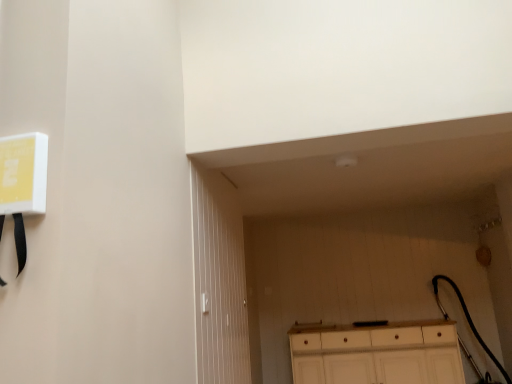
The width and height of the screenshot is (512, 384). What do you see at coordinates (377, 354) in the screenshot?
I see `white wood cabinet at lower center` at bounding box center [377, 354].

Measure the distance between white wood cabinet at lower center and camera.

white wood cabinet at lower center is 3.79 meters from camera.

Find the location of a particular element. The width and height of the screenshot is (512, 384). white wood cabinet at lower center is located at coordinates (377, 354).

What are the coordinates of `white wooden door at center` in the screenshot? It's located at (219, 280).

Describe the element at coordinates (219, 280) in the screenshot. I see `white wooden door at center` at that location.

Measure the distance between white wooden door at center and camera.

The distance of white wooden door at center from camera is 1.95 meters.

What is the approximate height of white wooden door at center?

white wooden door at center is 1.38 meters tall.

Locate an element on the screen. white wood cabinet at lower center is located at coordinates (377, 354).

Can you confirm if white wood cabinet at lower center is positioned to the left of white wooden door at center?

Incorrect, white wood cabinet at lower center is not on the left side of white wooden door at center.

Considering the relative positions of white wood cabinet at lower center and white wooden door at center in the image provided, is white wood cabinet at lower center behind white wooden door at center?

Yes, it is.

Which is farther from the camera, (462, 380) or (196, 293)?

The point (462, 380) is more distant.

From the image's perspective, relative to white wooden door at center, is white wood cabinet at lower center above or below?

white wood cabinet at lower center is below white wooden door at center.

From a real-world perspective, is white wood cabinet at lower center positioned above or below white wooden door at center?

From a real-world perspective, white wood cabinet at lower center is physically below white wooden door at center.

In terms of width, does white wood cabinet at lower center look wider or thinner when compared to white wooden door at center?

Considering their sizes, white wood cabinet at lower center looks broader than white wooden door at center.

Between white wood cabinet at lower center and white wooden door at center, which one has more height?

With more height is white wooden door at center.

Is white wood cabinet at lower center bigger than white wooden door at center?

Yes.

Would you say white wood cabinet at lower center is outside white wooden door at center?

white wood cabinet at lower center lies outside white wooden door at center's area.

Is white wood cabinet at lower center far from white wooden door at center?

Yes, white wood cabinet at lower center and white wooden door at center are located far from each other.

Is white wood cabinet at lower center oriented away from white wooden door at center?

No, white wood cabinet at lower center is not facing away from white wooden door at center.

From the picture: Can you tell me how much white wood cabinet at lower center and white wooden door at center differ in facing direction?

The angular difference between white wood cabinet at lower center and white wooden door at center is 91.7 degrees.

Measure the distance from white wood cabinet at lower center to white wooden door at center.

They are 1.62 meters apart.

The image size is (512, 384). Identify the location of door above the white wood cabinet at lower center (from a real-world perspective). (219, 280).

Considering the relative positions of white wooden door at center and white wood cabinet at lower center in the image provided, is white wooden door at center to the right of white wood cabinet at lower center from the viewer's perspective?

No.

Is white wooden door at center behind white wood cabinet at lower center?

No.

Is point (214, 232) farther from camera compared to point (348, 375)?

No, it is not.

From the image's perspective, which object appears higher, white wooden door at center or white wood cabinet at lower center?

white wooden door at center appears higher in the image.

From a real-world perspective, is white wooden door at center located beneath white wood cabinet at lower center?

Incorrect, from a real-world perspective, white wooden door at center is higher than white wood cabinet at lower center.

Considering the sizes of objects white wooden door at center and white wood cabinet at lower center in the image provided, who is wider, white wooden door at center or white wood cabinet at lower center?

white wood cabinet at lower center.

Between white wooden door at center and white wood cabinet at lower center, which one has more height?

white wooden door at center is taller.

Can you confirm if white wooden door at center is bigger than white wood cabinet at lower center?

Incorrect, white wooden door at center is not larger than white wood cabinet at lower center.

Would you say white wood cabinet at lower center is part of white wooden door at center's contents?

No, white wood cabinet at lower center is not a part of white wooden door at center.

Are white wooden door at center and white wood cabinet at lower center located far from each other?

Yes.

Is white wooden door at center turned away from white wood cabinet at lower center?

No, white wooden door at center is not facing away from white wood cabinet at lower center.

How different are the orientations of white wooden door at center and white wood cabinet at lower center in degrees?

The facing directions of white wooden door at center and white wood cabinet at lower center are 91.7 degrees apart.

Where is `cabinetry that appears below the white wooden door at center (from the image's perspective)`? This screenshot has width=512, height=384. cabinetry that appears below the white wooden door at center (from the image's perspective) is located at coordinates [x=377, y=354].

In order to click on cabinetry behind the white wooden door at center in this screenshot , I will do `click(377, 354)`.

The image size is (512, 384). I want to click on cabinetry lying below the white wooden door at center (from the image's perspective), so click(377, 354).